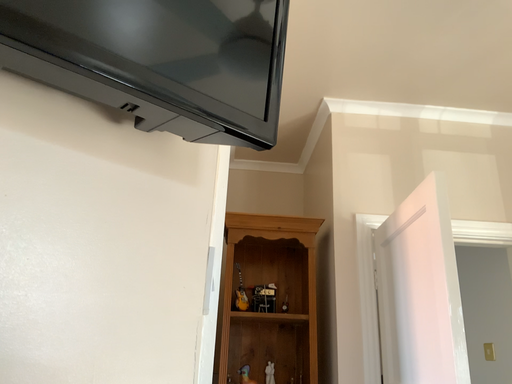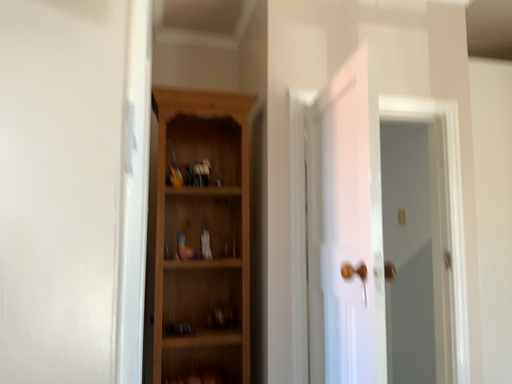
Question: How did the camera likely rotate when shooting the video?

Choices:
 (A) rotated left
 (B) rotated right

Answer: (B)